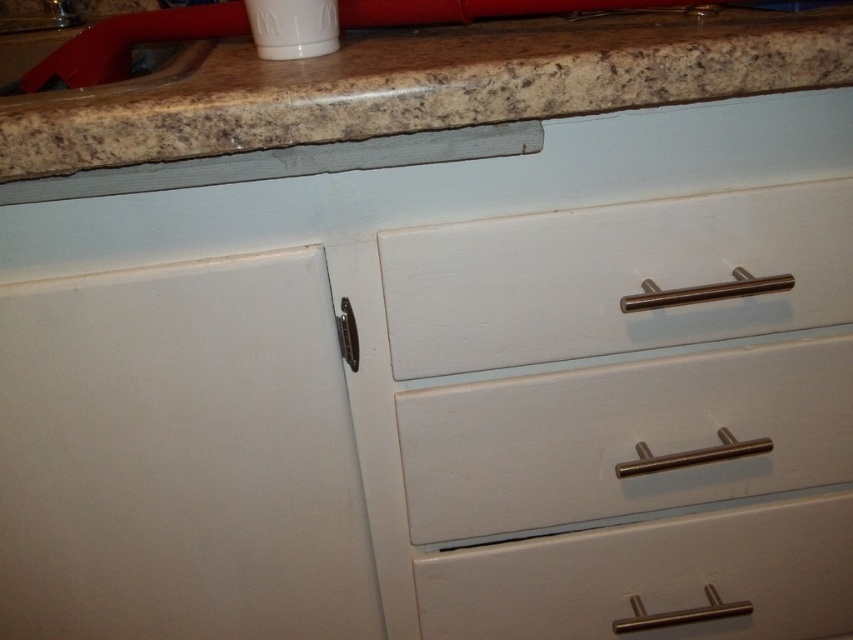
Question: Does white matte drawer at center have a greater width compared to white painted wood drawer at center?

Choices:
 (A) no
 (B) yes

Answer: (B)

Question: Can you confirm if brown granite countertop at upper center is positioned below white painted wood drawer at center?

Choices:
 (A) no
 (B) yes

Answer: (A)

Question: Which point is farther from the camera taking this photo?

Choices:
 (A) (119, 19)
 (B) (221, 60)
 (C) (828, 257)

Answer: (A)

Question: Which point is farther to the camera?

Choices:
 (A) brown granite countertop at upper center
 (B) brushed metal sink at upper left
 (C) white matte drawer at center

Answer: (C)

Question: Which object is closer to the camera taking this photo?

Choices:
 (A) matte white drawer at center
 (B) brown granite countertop at upper center
 (C) brushed metal sink at upper left
 (D) white matte drawer at center

Answer: (B)

Question: Is white matte drawer at center positioned behind brushed metal sink at upper left?

Choices:
 (A) yes
 (B) no

Answer: (A)